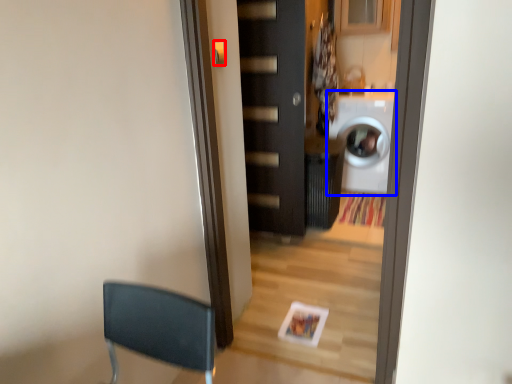
Question: Which point is further to the camera, door handle (highlighted by a red box) or washing machine (highlighted by a blue box)?

Choices:
 (A) door handle
 (B) washing machine

Answer: (B)